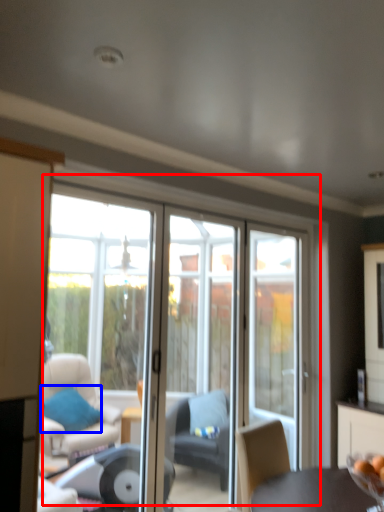
Question: Which of the following is the farthest to the observer, door (highlighted by a red box) or pillow (highlighted by a blue box)?

Choices:
 (A) door
 (B) pillow

Answer: (B)